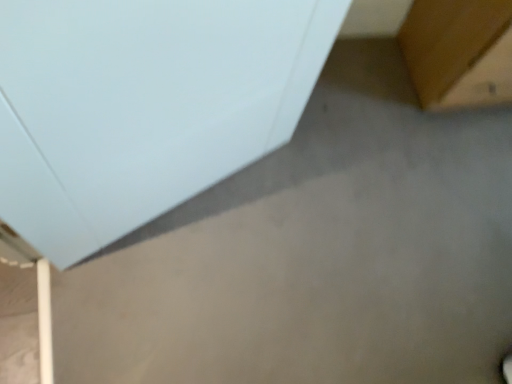
Question: In the image, is brown wood table at upper right, which appears as the first furniture when viewed from the right, on the left side or the right side of white matte cabinet at upper left, which appears as the second furniture when viewed from the right?

Choices:
 (A) right
 (B) left

Answer: (A)

Question: Is point (478, 18) closer or farther from the camera than point (196, 36)?

Choices:
 (A) closer
 (B) farther

Answer: (B)

Question: Is brown wood table at upper right, placed as the 2th furniture when sorted from left to right, spatially inside white matte cabinet at upper left, which appears as the second furniture when viewed from the right, or outside of it?

Choices:
 (A) inside
 (B) outside

Answer: (B)

Question: Is white matte cabinet at upper left, which appears as the second furniture when viewed from the right, wider or thinner than brown wood table at upper right, which appears as the first furniture when viewed from the right?

Choices:
 (A) thin
 (B) wide

Answer: (A)

Question: Is point (311, 36) positioned closer to the camera than point (458, 64)?

Choices:
 (A) closer
 (B) farther

Answer: (A)

Question: Relative to brown wood table at upper right, placed as the 2th furniture when sorted from left to right, is white matte cabinet at upper left, which is counted as the first furniture, starting from the left, in front or behind?

Choices:
 (A) behind
 (B) front

Answer: (B)

Question: Based on their sizes in the image, would you say white matte cabinet at upper left, which is counted as the first furniture, starting from the left, is bigger or smaller than brown wood table at upper right, placed as the 2th furniture when sorted from left to right?

Choices:
 (A) big
 (B) small

Answer: (B)